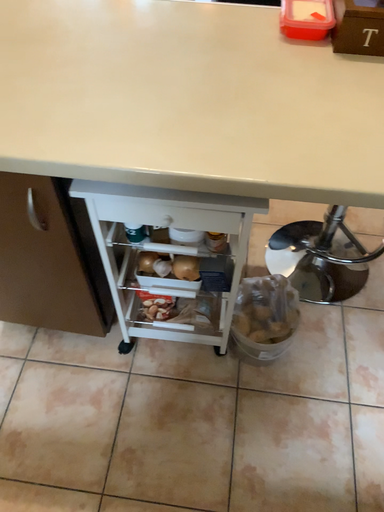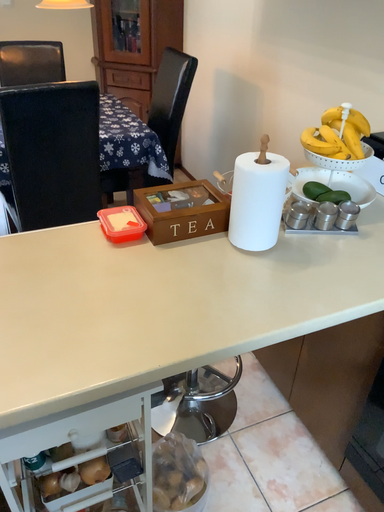
Question: Which way did the camera rotate in the video?

Choices:
 (A) rotated right
 (B) rotated left

Answer: (A)